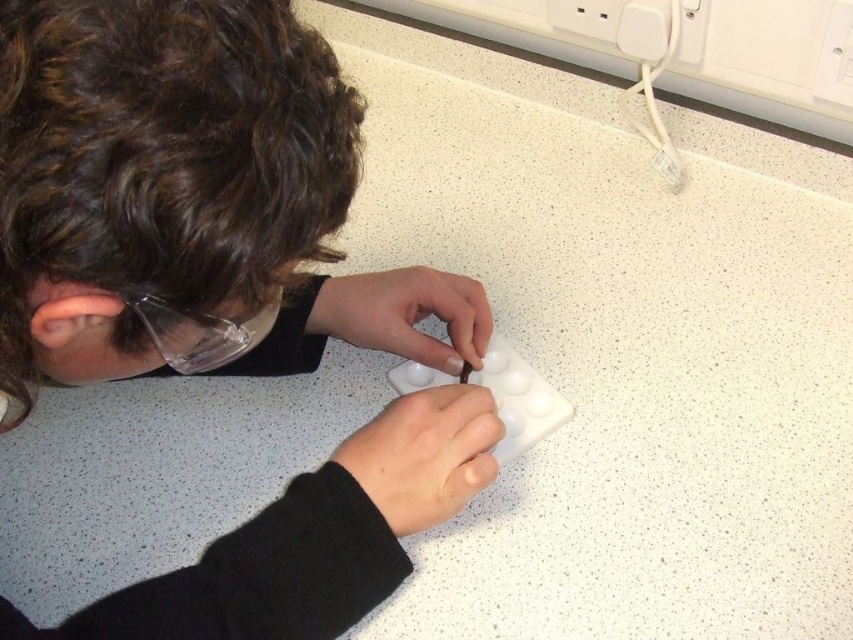
Question: Is white matte pill container at lower center behind white matte pill box at center?

Choices:
 (A) yes
 (B) no

Answer: (B)

Question: Which point is closer to the camera?

Choices:
 (A) (387, 276)
 (B) (381, 438)

Answer: (B)

Question: Among these objects, which one is nearest to the camera?

Choices:
 (A) white matte pill box at center
 (B) white matte pill container at lower center

Answer: (B)

Question: Is white matte pill container at lower center to the left of white matte pill box at center from the viewer's perspective?

Choices:
 (A) no
 (B) yes

Answer: (A)

Question: Which point appears closest to the camera in this image?

Choices:
 (A) (480, 451)
 (B) (323, 301)

Answer: (A)

Question: Does white matte pill container at lower center appear under white matte pill box at center?

Choices:
 (A) yes
 (B) no

Answer: (A)